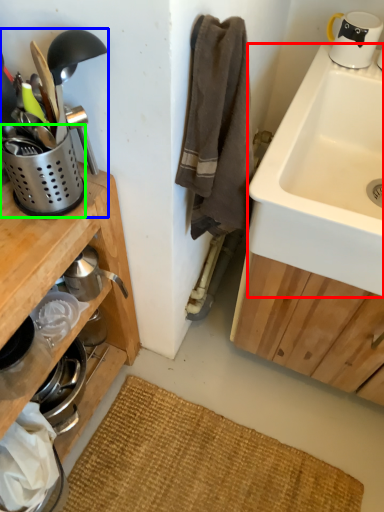
Question: Which object is positioned farthest from sink (highlighted by a red box)? Select from appliance (highlighted by a blue box) and appliance (highlighted by a green box).

Choices:
 (A) appliance
 (B) appliance

Answer: (B)